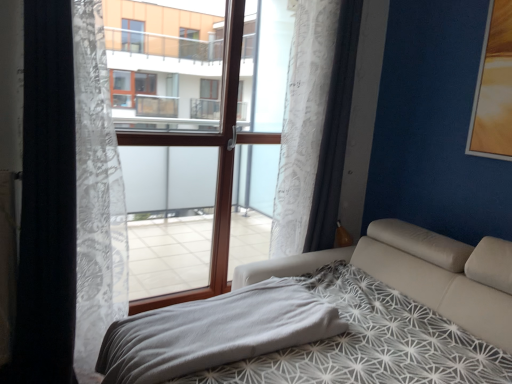
What do you see at coordinates (47, 202) in the screenshot?
I see `white sheer curtain at left, which ranks as the 3th curtain in right-to-left order` at bounding box center [47, 202].

Locate an element on the screen. The width and height of the screenshot is (512, 384). white lace curtain at center, arranged as the 3th curtain when viewed from the left is located at coordinates (303, 122).

Identify the location of white leather bed at center. The height and width of the screenshot is (384, 512). (337, 318).

Identify the location of white lace curtain at left, which ranks as the second curtain in right-to-left order. This screenshot has width=512, height=384. (96, 195).

Locate an element on the screen. white sheer curtain at left, which ranks as the 3th curtain in right-to-left order is located at coordinates (47, 202).

From the image's perspective, between white sheer curtain at left, which ranks as the 3th curtain in right-to-left order, and white leather bed at center, who is located below?

white leather bed at center is shown below in the image.

Which of these two, white sheer curtain at left, which ranks as the 3th curtain in right-to-left order, or white leather bed at center, is bigger?

white leather bed at center is bigger.

From their relative heights in the image, would you say white sheer curtain at left, which ranks as the 1th curtain in left-to-right order, is taller or shorter than white leather bed at center?

In the image, white sheer curtain at left, which ranks as the 1th curtain in left-to-right order, appears to be taller than white leather bed at center.

There is a white leather bed at center. At what (x,y) coordinates should I click in order to perform the action: click on the 1st curtain above it (from a real-world perspective). Please return your answer as a coordinate pair (x, y). Looking at the image, I should click on (47, 202).

Considering the positions of objects brown wood window frame at center and white sheer curtain at left, which ranks as the 3th curtain in right-to-left order, in the image provided, who is behind, brown wood window frame at center or white sheer curtain at left, which ranks as the 3th curtain in right-to-left order,?

Positioned behind is brown wood window frame at center.

The image size is (512, 384). I want to click on window frame that appears above the white sheer curtain at left, which ranks as the 3th curtain in right-to-left order (from the image's perspective), so click(x=196, y=139).

From the picture: Is brown wood window frame at center looking in the opposite direction of white sheer curtain at left, which ranks as the 1th curtain in left-to-right order?

No, brown wood window frame at center is not facing away from white sheer curtain at left, which ranks as the 1th curtain in left-to-right order.

Is white lace curtain at center, arranged as the 3th curtain when viewed from the left, behind white sheer curtain at left, which ranks as the 3th curtain in right-to-left order?

Yes, white lace curtain at center, arranged as the 3th curtain when viewed from the left, is further from the camera.

Between white lace curtain at center, the 1th curtain viewed from the right, and white sheer curtain at left, which ranks as the 3th curtain in right-to-left order, which one appears on the right side from the viewer's perspective?

From the viewer's perspective, white lace curtain at center, the 1th curtain viewed from the right, appears more on the right side.

From the image's perspective, who appears lower, white lace curtain at center, the 1th curtain viewed from the right, or white sheer curtain at left, which ranks as the 1th curtain in left-to-right order?

white sheer curtain at left, which ranks as the 1th curtain in left-to-right order, appears lower in the image.

Could white leather bed at center be considered to be inside brown wood window frame at center?

No, white leather bed at center is not a part of brown wood window frame at center.

Between brown wood window frame at center and white leather bed at center, which one has more height?

Standing taller between the two is brown wood window frame at center.

Is brown wood window frame at center directly adjacent to white leather bed at center?

No, brown wood window frame at center is not with white leather bed at center.

Can you confirm if brown wood window frame at center is smaller than white leather bed at center?

Yes.

Is gray soft blanket at lower center with white sheer curtain at left, which ranks as the 3th curtain in right-to-left order?

They are not placed beside each other.

Is gray soft blanket at lower center outside of white sheer curtain at left, which ranks as the 3th curtain in right-to-left order?

That's correct, gray soft blanket at lower center is outside of white sheer curtain at left, which ranks as the 3th curtain in right-to-left order.

Is gray soft blanket at lower center in front of white sheer curtain at left, which ranks as the 3th curtain in right-to-left order?

Yes, gray soft blanket at lower center is closer to the viewer.

Which is more distant, (x=249, y=329) or (x=65, y=189)?

The point (x=65, y=189) is farther.

Is white lace curtain at center, arranged as the 3th curtain when viewed from the left, located within white lace curtain at left, which ranks as the second curtain in right-to-left order?

That's incorrect, white lace curtain at center, arranged as the 3th curtain when viewed from the left, is not inside white lace curtain at left, which ranks as the second curtain in right-to-left order.

Considering the sizes of objects white lace curtain at left, marked as the 2th curtain in a left-to-right arrangement, and white lace curtain at center, arranged as the 3th curtain when viewed from the left, in the image provided, who is shorter, white lace curtain at left, marked as the 2th curtain in a left-to-right arrangement, or white lace curtain at center, arranged as the 3th curtain when viewed from the left,?

white lace curtain at center, arranged as the 3th curtain when viewed from the left, is shorter.

What's the angular difference between white lace curtain at left, marked as the 2th curtain in a left-to-right arrangement, and white lace curtain at center, the 1th curtain viewed from the right,'s facing directions?

white lace curtain at left, marked as the 2th curtain in a left-to-right arrangement, and white lace curtain at center, the 1th curtain viewed from the right, are facing 7.54e-05 degrees away from each other.

Between point (114, 175) and point (307, 224), which one is positioned behind?

The point (307, 224) is more distant.

Which of these two, white leather bed at center or brown wood window frame at center, stands taller?

Standing taller between the two is brown wood window frame at center.

In the scene shown: How far apart are white leather bed at center and brown wood window frame at center?

The distance of white leather bed at center from brown wood window frame at center is 3.54 feet.

Considering the relative sizes of white leather bed at center and brown wood window frame at center in the image provided, is white leather bed at center bigger than brown wood window frame at center?

Correct, white leather bed at center is larger in size than brown wood window frame at center.

Image resolution: width=512 pixels, height=384 pixels. Identify the location of bed in front of the white sheer curtain at left, which ranks as the 3th curtain in right-to-left order. (337, 318).

From the brown wood window frame at center, count the 2nd curtain to the left and point to it. Please provide its 2D coordinates.

[(47, 202)]

Looking at the image, which one is located further to white leather bed at center, white sheer curtain at left, which ranks as the 3th curtain in right-to-left order, or white lace curtain at center, the 1th curtain viewed from the right?

white sheer curtain at left, which ranks as the 3th curtain in right-to-left order.

Estimate the real-world distances between objects in this image. Which object is closer to white lace curtain at center, arranged as the 3th curtain when viewed from the left, brown wood window frame at center or white leather bed at center?

Based on the image, brown wood window frame at center appears to be nearer to white lace curtain at center, arranged as the 3th curtain when viewed from the left.

Based on their spatial positions, is white sheer curtain at left, which ranks as the 3th curtain in right-to-left order, or white lace curtain at left, marked as the 2th curtain in a left-to-right arrangement, closer to gray soft blanket at lower center?

white lace curtain at left, marked as the 2th curtain in a left-to-right arrangement, is positioned closer to the anchor gray soft blanket at lower center.

Looking at the image, which one is located closer to brown wood window frame at center, gray soft blanket at lower center or white sheer curtain at left, which ranks as the 3th curtain in right-to-left order?

white sheer curtain at left, which ranks as the 3th curtain in right-to-left order, is positioned closer to the anchor brown wood window frame at center.

Based on their spatial positions, is white sheer curtain at left, which ranks as the 1th curtain in left-to-right order, or brown wood window frame at center further from white leather bed at center?

The object further to white leather bed at center is brown wood window frame at center.

Based on their spatial positions, is brown wood window frame at center or white leather bed at center further from gray soft blanket at lower center?

brown wood window frame at center is positioned further to the anchor gray soft blanket at lower center.

Considering their positions, is brown wood window frame at center positioned closer to white lace curtain at left, marked as the 2th curtain in a left-to-right arrangement, than white sheer curtain at left, which ranks as the 3th curtain in right-to-left order?

white sheer curtain at left, which ranks as the 3th curtain in right-to-left order, lies closer to white lace curtain at left, marked as the 2th curtain in a left-to-right arrangement, than the other object.

Estimate the real-world distances between objects in this image. Which object is closer to gray soft blanket at lower center, white sheer curtain at left, which ranks as the 1th curtain in left-to-right order, or brown wood window frame at center?

Among the two, white sheer curtain at left, which ranks as the 1th curtain in left-to-right order, is located nearer to gray soft blanket at lower center.

What are the coordinates of `curtain located between white sheer curtain at left, which ranks as the 3th curtain in right-to-left order, and gray soft blanket at lower center in the left-right direction` in the screenshot? It's located at (96, 195).

Image resolution: width=512 pixels, height=384 pixels. I want to click on blanket between white sheer curtain at left, which ranks as the 1th curtain in left-to-right order, and white lace curtain at center, arranged as the 3th curtain when viewed from the left, from left to right, so click(x=215, y=332).

Where is `blanket located between white leather bed at center and brown wood window frame at center in the depth direction`? The image size is (512, 384). blanket located between white leather bed at center and brown wood window frame at center in the depth direction is located at coordinates (215, 332).

Where is `window frame between white lace curtain at left, which ranks as the second curtain in right-to-left order, and white lace curtain at center, arranged as the 3th curtain when viewed from the left, from left to right`? window frame between white lace curtain at left, which ranks as the second curtain in right-to-left order, and white lace curtain at center, arranged as the 3th curtain when viewed from the left, from left to right is located at coordinates coord(196,139).